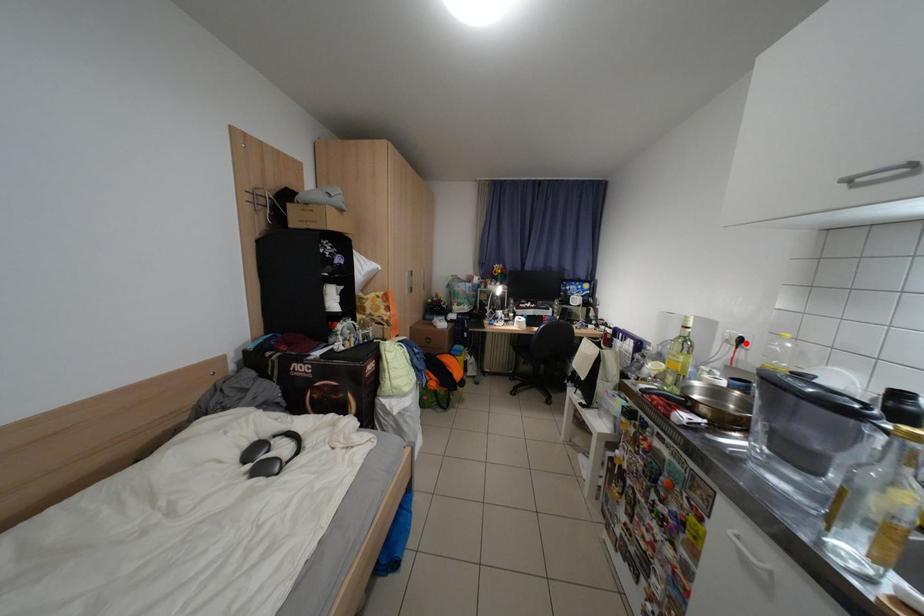
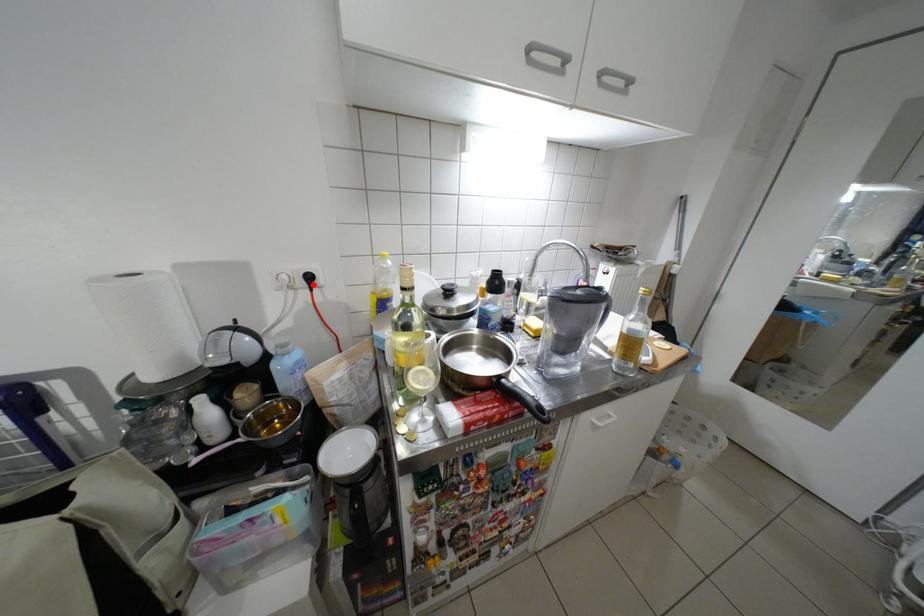
I am providing you with two images of the same scene from different viewpoints. A red point is marked on the first image and another point is marked on the second image. Is the red point in image1 aligned with the point shown in image2?

Yes